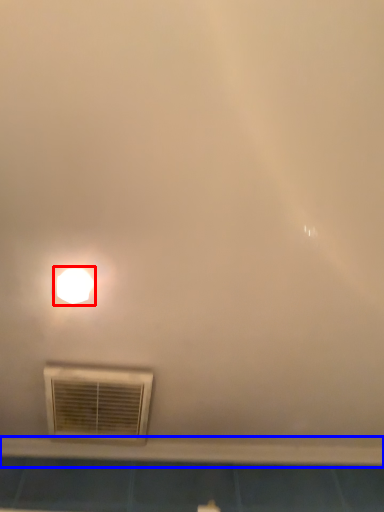
Question: Among these objects, which one is farthest to the camera, lamp (highlighted by a red box) or window sill (highlighted by a blue box)?

Choices:
 (A) lamp
 (B) window sill

Answer: (B)